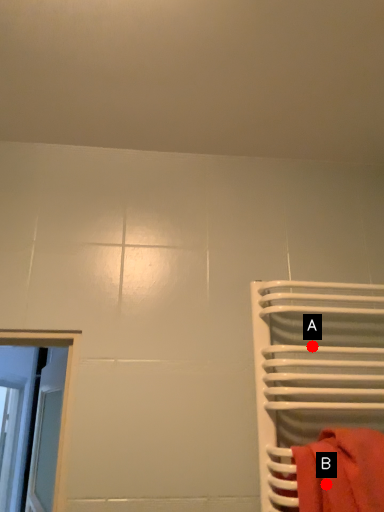
Question: Two points are circled on the image, labeled by A and B beside each circle. Which point is farther from the camera taking this photo?

Choices:
 (A) A is further
 (B) B is further

Answer: (A)